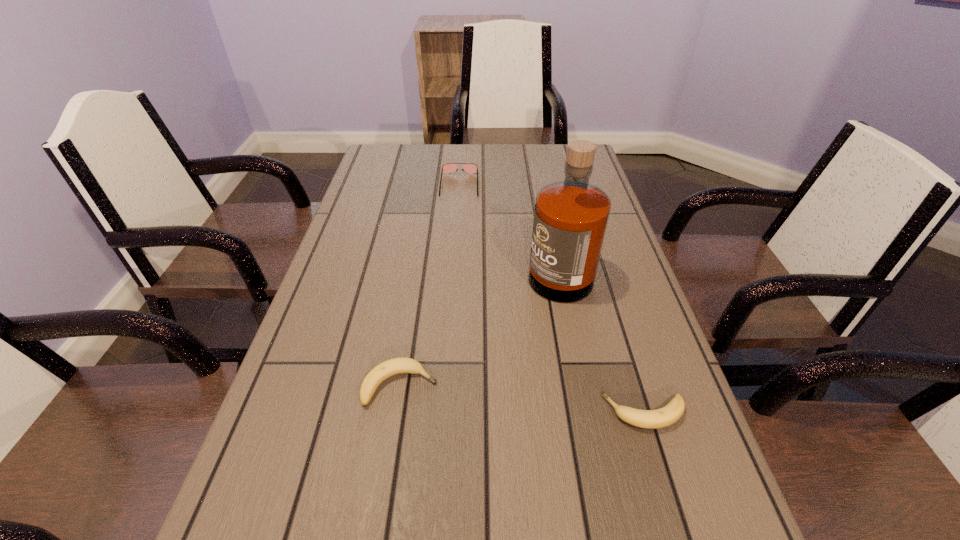
Identify the location of free location located 0.280m on the right of the left banana. (584, 386).

This screenshot has width=960, height=540. Identify the location of vacant space located 0.310m at the stem of the right banana. (433, 413).

The image size is (960, 540). Find the location of `vacant space located at the stem of the right banana`. vacant space located at the stem of the right banana is located at coordinates (411, 413).

Locate an element on the screen. free space located at the stem of the right banana is located at coordinates (571, 413).

Identify the location of object located in the far edge section of the desktop. (447, 167).

Where is `object present at the left edge`? object present at the left edge is located at coordinates (386, 369).

The width and height of the screenshot is (960, 540). Identify the location of liquor situated at the right edge. (570, 221).

Identify the location of banana that is at the right edge. (651, 419).

Identify the location of free spot at the far edge of the desktop. The width and height of the screenshot is (960, 540). (437, 161).

The width and height of the screenshot is (960, 540). In order to click on vacant area at the left edge in this screenshot , I will do `click(292, 438)`.